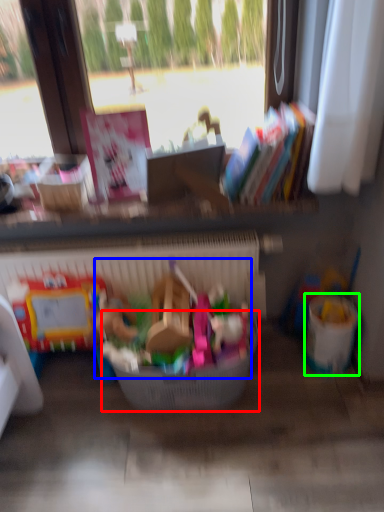
Question: Estimate the real-world distances between objects in this image. Which object is closer to basket (highlighted by a red box), toy (highlighted by a blue box) or recycling bin (highlighted by a green box)?

Choices:
 (A) toy
 (B) recycling bin

Answer: (A)